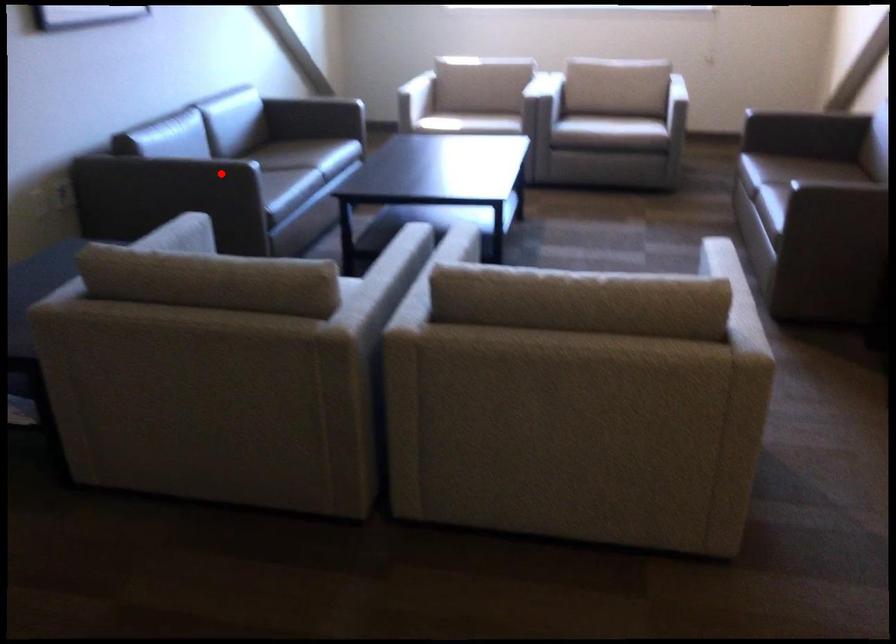
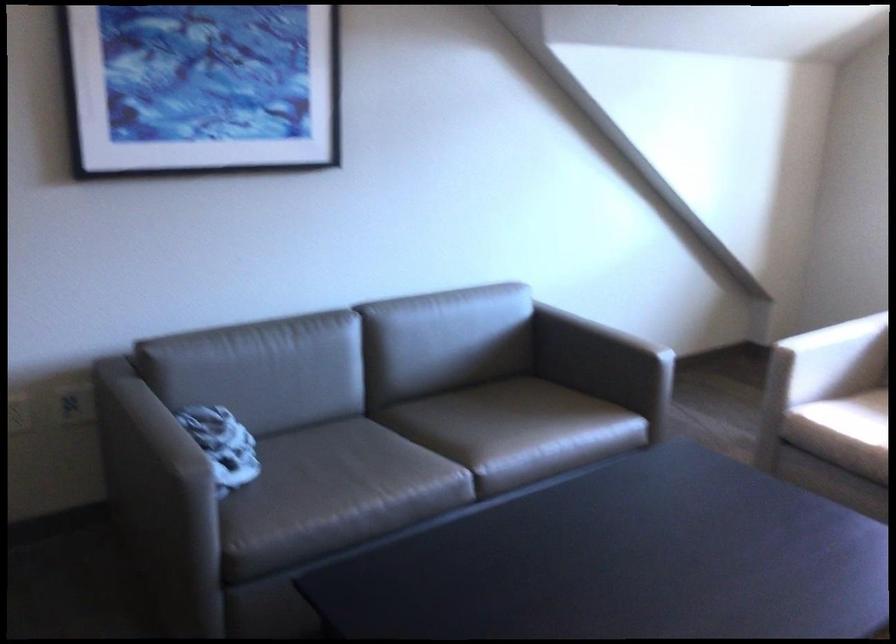
Question: I am providing you with two images of the same scene from different viewpoints. Image1 has a red point marked. In image2, the corresponding 3D location appears at what relative position? Reply with the corresponding letter.

Choices:
 (A) Closer
 (B) Farther

Answer: (A)